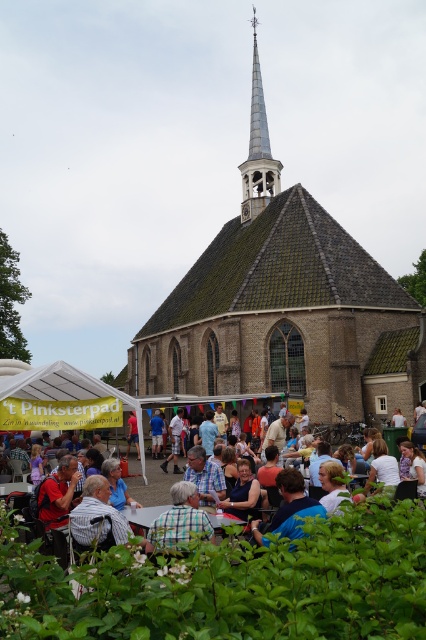
Question: Estimate the real-world distances between objects in this image. Which object is farther from the white fabric canopy at lower left?

Choices:
 (A) checkered fabric shirt at center
 (B) silver metallic spire at upper center
 (C) brown brick church at center

Answer: (B)

Question: Among these objects, which one is nearest to the camera?

Choices:
 (A) blue plaid shirt at center
 (B) silver metallic spire at upper center

Answer: (A)

Question: Observing the image, what is the correct spatial positioning of silver metallic spire at upper center in reference to gray striped shirt at center?

Choices:
 (A) below
 (B) above

Answer: (B)

Question: Can you confirm if silver metallic spire at upper center is positioned below gray striped shirt at center?

Choices:
 (A) no
 (B) yes

Answer: (A)

Question: Can you confirm if brown brick church at center is thinner than blue shirt at center?

Choices:
 (A) no
 (B) yes

Answer: (A)

Question: Which point is closer to the camera taking this photo?

Choices:
 (A) (150, 509)
 (B) (25, 387)
 (C) (333, 416)
 (D) (94, 524)

Answer: (D)